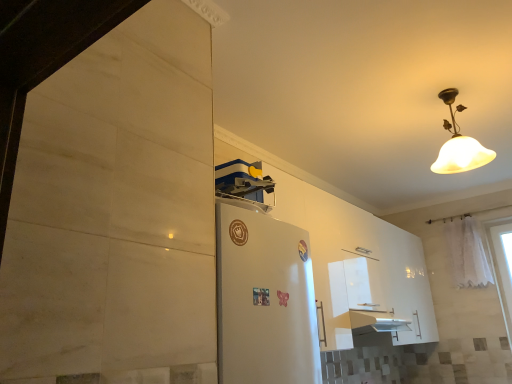
Question: In terms of size, does white matte lampshade at upper right appear bigger or smaller than white sheer curtain at right?

Choices:
 (A) small
 (B) big

Answer: (B)

Question: In the image, is white matte lampshade at upper right on the left side or the right side of white sheer curtain at right?

Choices:
 (A) left
 (B) right

Answer: (A)

Question: Is white matte lampshade at upper right situated inside white sheer curtain at right or outside?

Choices:
 (A) outside
 (B) inside

Answer: (A)

Question: From a real-world perspective, relative to white matte lampshade at upper right, is white sheer curtain at right vertically above or below?

Choices:
 (A) below
 (B) above

Answer: (A)

Question: Considering the positions of white sheer curtain at right and white matte lampshade at upper right in the image, is white sheer curtain at right bigger or smaller than white matte lampshade at upper right?

Choices:
 (A) small
 (B) big

Answer: (A)

Question: Based on their positions, is white sheer curtain at right located to the left or right of white matte lampshade at upper right?

Choices:
 (A) right
 (B) left

Answer: (A)

Question: Considering their positions, is white sheer curtain at right located in front of or behind white matte lampshade at upper right?

Choices:
 (A) behind
 (B) front

Answer: (A)